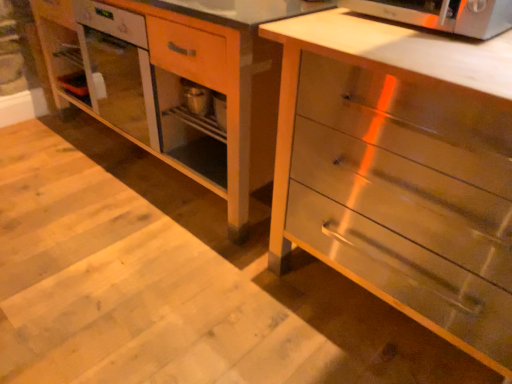
This screenshot has width=512, height=384. I want to click on vacant space in front of satin silver microwave oven at upper right, so point(435,50).